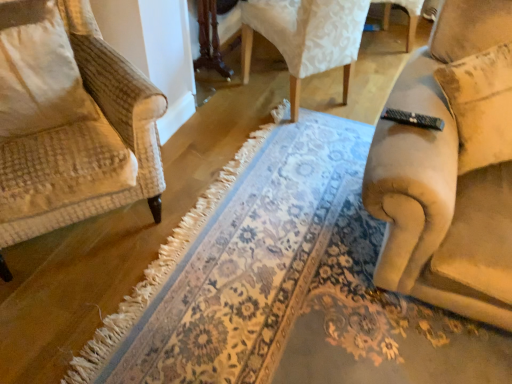
Question: Is beige textured pillow at left to the left of floral carpet at center from the viewer's perspective?

Choices:
 (A) yes
 (B) no

Answer: (A)

Question: From a real-world perspective, is beige textured pillow at left positioned over floral carpet at center based on gravity?

Choices:
 (A) no
 (B) yes

Answer: (B)

Question: From the image's perspective, is beige textured pillow at left above floral carpet at center?

Choices:
 (A) yes
 (B) no

Answer: (A)

Question: Considering the relative sizes of beige textured pillow at left and floral carpet at center in the image provided, is beige textured pillow at left taller than floral carpet at center?

Choices:
 (A) no
 (B) yes

Answer: (B)

Question: Does beige textured pillow at left have a larger size compared to floral carpet at center?

Choices:
 (A) no
 (B) yes

Answer: (A)

Question: From a real-world perspective, relative to beige fabric couch at right, arranged as the first chair when viewed from the front, is beige textured pillow at left vertically above or below?

Choices:
 (A) below
 (B) above

Answer: (A)

Question: From their relative heights in the image, would you say beige textured pillow at left is taller or shorter than beige fabric couch at right, arranged as the first chair when viewed from the front?

Choices:
 (A) tall
 (B) short

Answer: (B)

Question: In the image, is beige textured pillow at left positioned in front of or behind beige fabric couch at right, the second chair in the back-to-front sequence?

Choices:
 (A) front
 (B) behind

Answer: (B)

Question: Does point (58, 14) appear closer or farther from the camera than point (410, 69)?

Choices:
 (A) closer
 (B) farther

Answer: (A)

Question: In terms of height, does velvet-like beige chair at upper center, which appears as the 1th chair when viewed from the back, look taller or shorter compared to beige textured pillow at left?

Choices:
 (A) short
 (B) tall

Answer: (B)

Question: Is velvet-like beige chair at upper center, which appears as the 1th chair when viewed from the back, inside the boundaries of beige textured pillow at left, or outside?

Choices:
 (A) inside
 (B) outside

Answer: (B)

Question: From the image's perspective, relative to beige textured pillow at left, is velvet-like beige chair at upper center, which appears as the 1th chair when viewed from the back, above or below?

Choices:
 (A) above
 (B) below

Answer: (A)

Question: Looking at the image, does velvet-like beige chair at upper center, which appears as the 1th chair when viewed from the back, seem bigger or smaller compared to beige textured pillow at left?

Choices:
 (A) small
 (B) big

Answer: (B)

Question: Considering the positions of point (432, 185) and point (220, 241), is point (432, 185) closer or farther from the camera than point (220, 241)?

Choices:
 (A) closer
 (B) farther

Answer: (A)

Question: Is beige fabric couch at right, arranged as the first chair when viewed from the front, to the left or to the right of floral carpet at center in the image?

Choices:
 (A) left
 (B) right

Answer: (B)